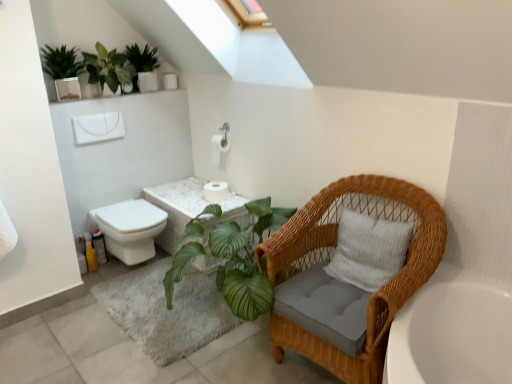
Where is `vacant position to the left of white matte toilet paper at center, placed as the second toilet paper when sorted from top to bottom`? The height and width of the screenshot is (384, 512). vacant position to the left of white matte toilet paper at center, placed as the second toilet paper when sorted from top to bottom is located at coordinates (188, 200).